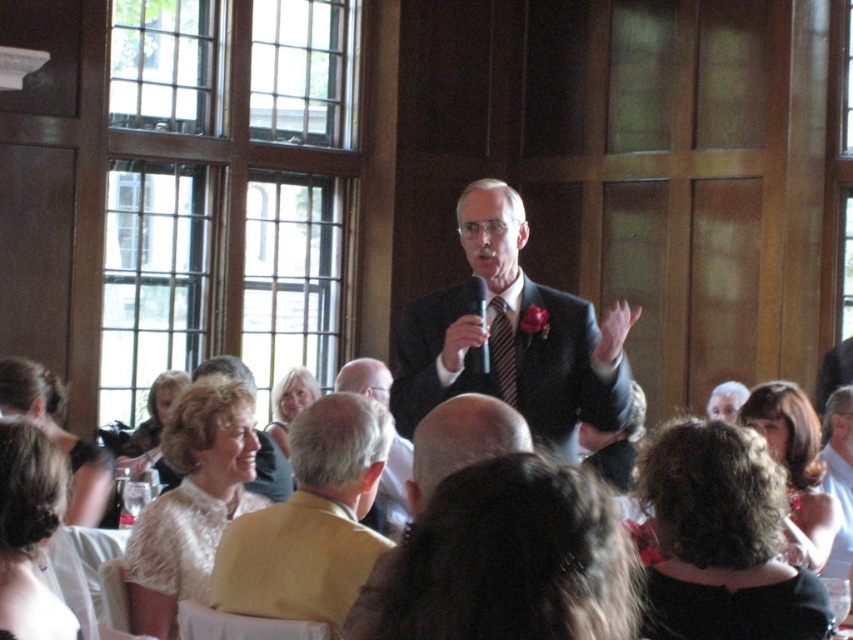
You are a photographer at the event and want to capture a photo that includes both the light brown suit at center and the light brown leather jacket at upper right. Based on their positions, which object should be placed higher in the frame to include both?

The light brown leather jacket at upper right should be placed higher in the frame because the light brown suit at center is located below it.

You are a photographer at the event and want to capture a photo of both the dark brown hair at center and the light beige fabric dress at center in the same frame. The camera you are using has a maximum focus range of 20 feet. Can you fit both subjects in the frame without moving the camera?

The distance between the dark brown hair at center and the light beige fabric dress at center is 22.14 feet, which exceeds the camera maximum focus range of 20 feet. Therefore, you cannot fit both subjects in the frame without moving the camera.